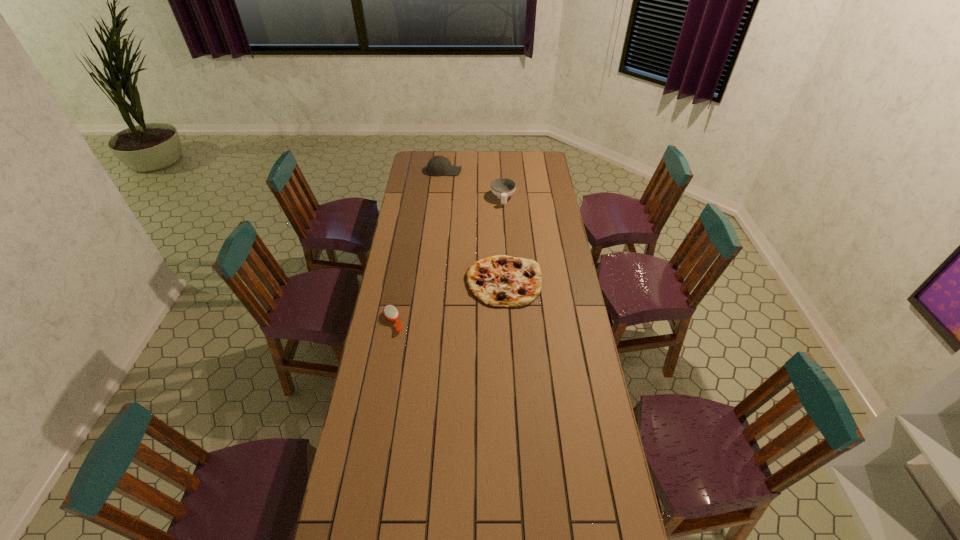
You are a GUI agent. You are given a task and a screenshot of the screen. Output one action in this format:
    pyautogui.click(x=<x>, y=<y>)
    Task: Click on the object that is at the far edge
    
    Given the screenshot: What is the action you would take?
    pyautogui.click(x=438, y=165)

Identify the location of baseball cap situated at the left edge. (438, 165).

This screenshot has height=540, width=960. Find the location of `hairbrush that is positioned at the left edge`. hairbrush that is positioned at the left edge is located at coordinates (390, 312).

Where is `object that is positioned at the right edge`? Image resolution: width=960 pixels, height=540 pixels. object that is positioned at the right edge is located at coordinates (500, 281).

You are a GUI agent. You are given a task and a screenshot of the screen. Output one action in this format:
    pyautogui.click(x=<x>, y=<y>)
    Task: Click on the object that is at the far left corner
    The height and width of the screenshot is (540, 960).
    Given the screenshot: What is the action you would take?
    pyautogui.click(x=438, y=165)

The width and height of the screenshot is (960, 540). Find the location of `vacant region at the left edge`. vacant region at the left edge is located at coordinates (392, 390).

Locate an element on the screen. Image resolution: width=960 pixels, height=540 pixels. vacant space at the right edge of the desktop is located at coordinates (565, 305).

At what (x,y) coordinates should I click in order to perform the action: click on vacant region at the far right corner of the desktop. Please return your answer as a coordinate pair (x, y). Looking at the image, I should click on (531, 163).

I want to click on empty space that is in between the second tallest object and the nearest object, so click(448, 260).

Where is `empty location between the second farthest object and the hairbrush`? The height and width of the screenshot is (540, 960). empty location between the second farthest object and the hairbrush is located at coordinates (448, 260).